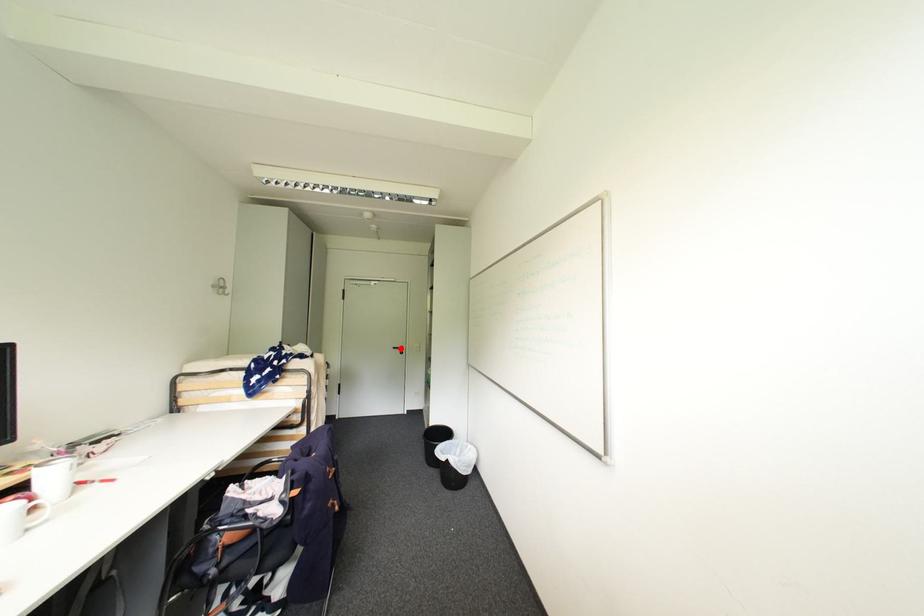
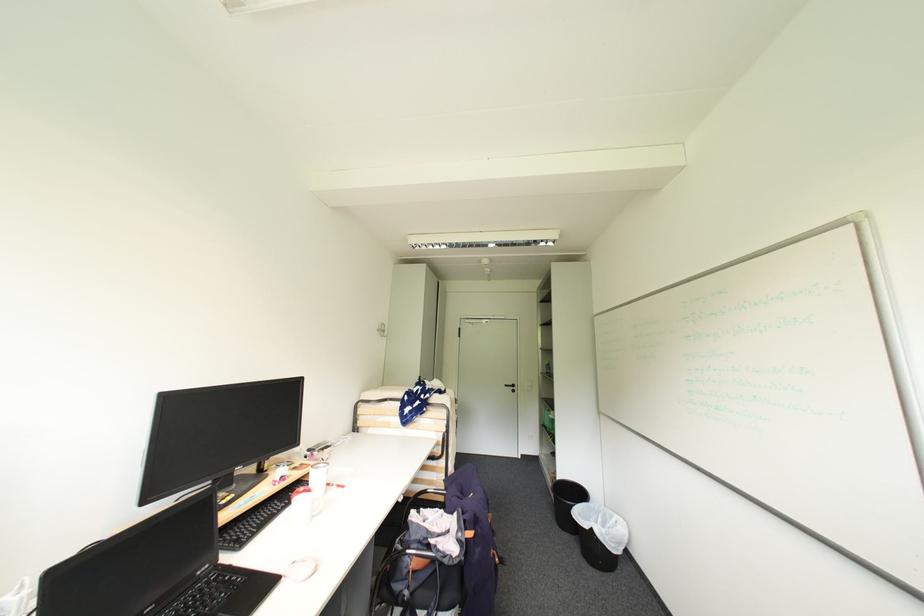
Question: A red point is marked in image1. In image2, is the corresponding 3D point closer to the camera or farther? Reply with the corresponding letter.

Choices:
 (A) The corresponding 3D point is closer.
 (B) The corresponding 3D point is farther.

Answer: (A)